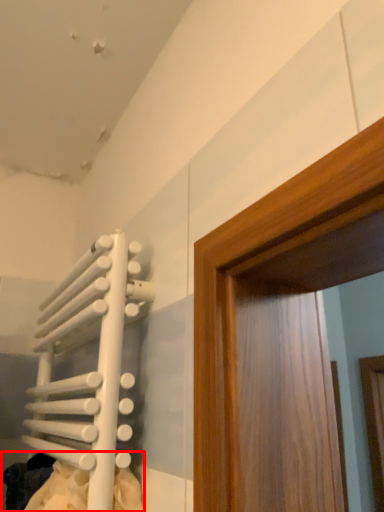
Question: From the image's perspective, what is the correct spatial positioning of laundry (annotated by the red box) in reference to radiator?

Choices:
 (A) above
 (B) below

Answer: (B)